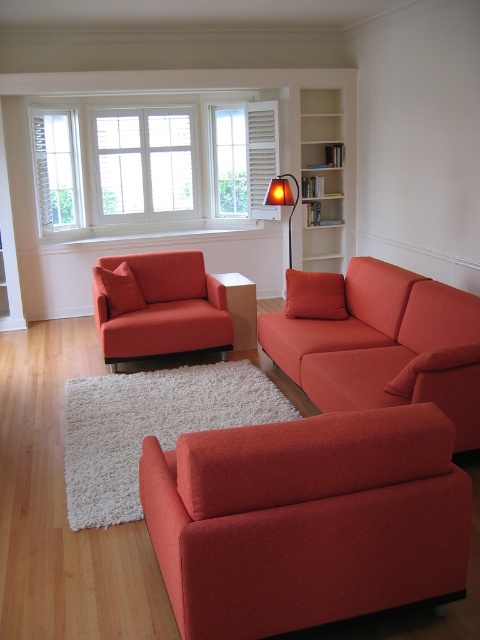
Question: Is matte orange armchair at lower center positioned before matte orange couch at center?

Choices:
 (A) no
 (B) yes

Answer: (B)

Question: Among these points, which one is farthest from the camera?

Choices:
 (A) (266, 148)
 (B) (291, 209)
 (C) (304, 193)
 (D) (126, 216)

Answer: (D)

Question: Is matte orange armchair at lower center smaller than white glass window at upper center?

Choices:
 (A) no
 (B) yes

Answer: (B)

Question: Based on their relative distances, which object is nearer to the white wood bookshelf at upper center?

Choices:
 (A) white wood shutters at upper center
 (B) orange fabric lamp at center
 (C) white glass window at upper center

Answer: (B)

Question: Which object is the farthest from the orange fabric lamp at center?

Choices:
 (A) white glass window at upper center
 (B) matte orange armchair at center

Answer: (B)

Question: Is white wood bookshelf at upper center behind orange fabric lamp at center?

Choices:
 (A) yes
 (B) no

Answer: (A)